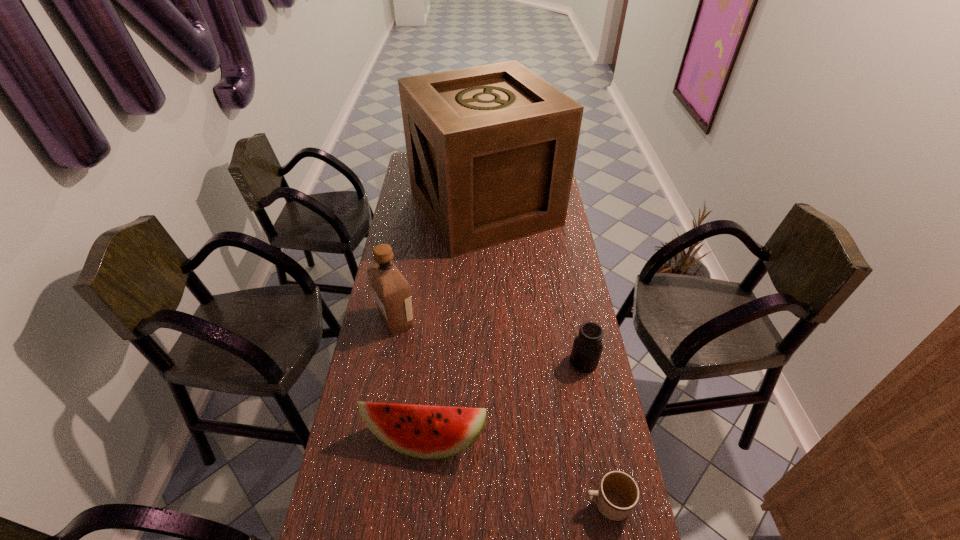
Find the location of a particular element. This screenshot has width=960, height=540. watermelon that is at the left edge is located at coordinates tap(423, 431).

You are a GUI agent. You are given a task and a screenshot of the screen. Output one action in this format:
    pyautogui.click(x=<x>, y=<y>)
    Task: Click on the box at the right edge
    This screenshot has width=960, height=540.
    Given the screenshot: What is the action you would take?
    pyautogui.click(x=491, y=149)

You are a GUI agent. You are given a task and a screenshot of the screen. Output one action in this format:
    pyautogui.click(x=<x>, y=<y>)
    Task: Click on the jar present at the right edge
    
    Given the screenshot: What is the action you would take?
    pyautogui.click(x=587, y=347)

In order to click on mug present at the right edge in this screenshot , I will do `click(618, 493)`.

Locate an element on the screen. The image size is (960, 540). object at the far left corner is located at coordinates (491, 149).

Where is `object that is at the far right corner`? object that is at the far right corner is located at coordinates (491, 149).

You are a GUI agent. You are given a task and a screenshot of the screen. Output one action in this format:
    pyautogui.click(x=<x>, y=<y>)
    Task: Click on the vacant space at the left edge of the desktop
    
    Given the screenshot: What is the action you would take?
    pyautogui.click(x=401, y=340)

Find the location of a particular element. The image size is (960, 540). vacant space at the right edge of the desktop is located at coordinates (577, 291).

The width and height of the screenshot is (960, 540). Find the location of `free space between the second shortest object and the fourth shortest object`. free space between the second shortest object and the fourth shortest object is located at coordinates (490, 341).

Where is `vacant space in between the watermelon and the second shortest object`? vacant space in between the watermelon and the second shortest object is located at coordinates (505, 400).